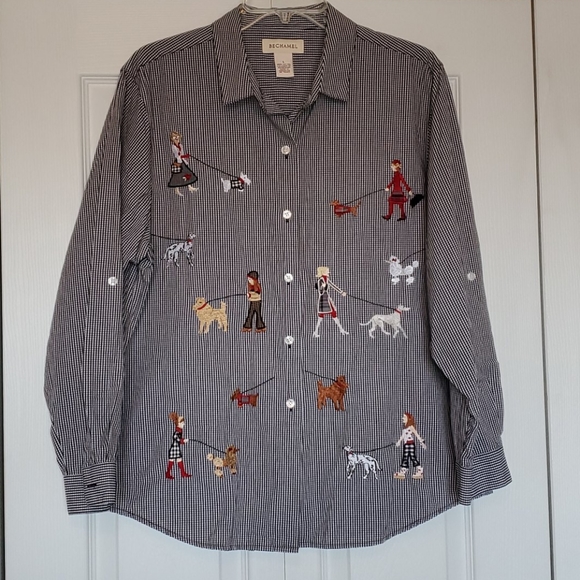
Identify the location of artwork low right. (329, 380).